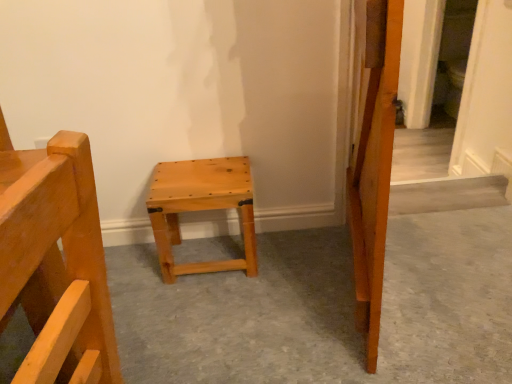
Question: Considering the relative sizes of natural wood stool at center and natural wood stool at center in the image provided, is natural wood stool at center smaller than natural wood stool at center?

Choices:
 (A) yes
 (B) no

Answer: (B)

Question: Does natural wood stool at center turn towards natural wood stool at center?

Choices:
 (A) no
 (B) yes

Answer: (A)

Question: Is there a large distance between natural wood stool at center and natural wood stool at center?

Choices:
 (A) no
 (B) yes

Answer: (A)

Question: Considering the relative positions of natural wood stool at center and natural wood stool at center in the image provided, is natural wood stool at center to the right of natural wood stool at center from the viewer's perspective?

Choices:
 (A) no
 (B) yes

Answer: (B)

Question: From a real-world perspective, is natural wood stool at center on natural wood stool at center?

Choices:
 (A) yes
 (B) no

Answer: (B)

Question: From a real-world perspective, is natural wood stool at center positioned under natural wood stool at center based on gravity?

Choices:
 (A) yes
 (B) no

Answer: (A)

Question: Would you say natural wood stool at center is outside natural wood stool at center?

Choices:
 (A) no
 (B) yes

Answer: (B)

Question: From a real-world perspective, is natural wood stool at center physically below natural wood stool at center?

Choices:
 (A) yes
 (B) no

Answer: (B)

Question: Can you see natural wood stool at center touching natural wood stool at center?

Choices:
 (A) yes
 (B) no

Answer: (B)

Question: Is the depth of natural wood stool at center less than that of natural wood stool at center?

Choices:
 (A) no
 (B) yes

Answer: (A)

Question: Is natural wood stool at center wider than natural wood stool at center?

Choices:
 (A) yes
 (B) no

Answer: (B)

Question: Is natural wood stool at center bigger than natural wood stool at center?

Choices:
 (A) yes
 (B) no

Answer: (B)

Question: From the image's perspective, is natural wood stool at center above or below natural wood stool at center?

Choices:
 (A) below
 (B) above

Answer: (B)